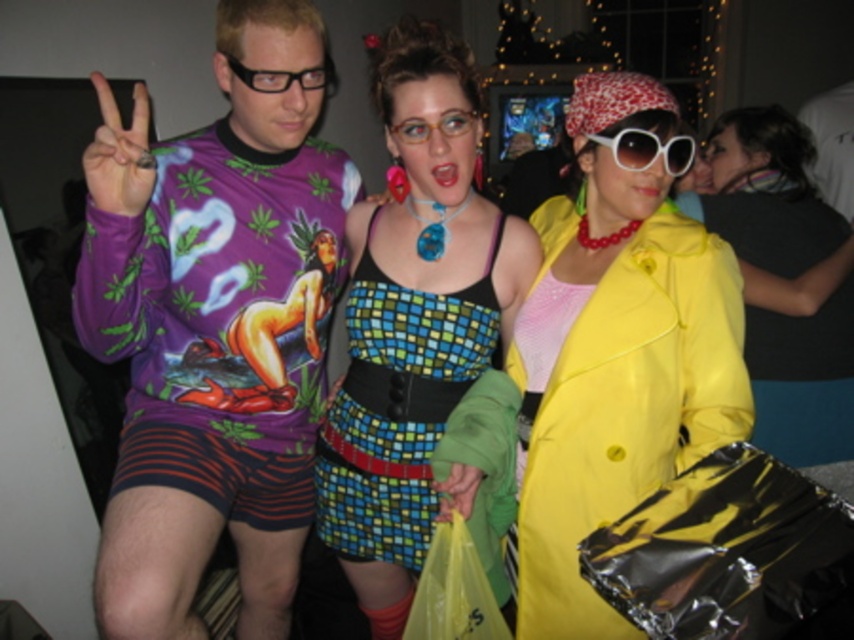
Question: Among these points, which one is farthest from the camera?

Choices:
 (A) (800, 244)
 (B) (630, 490)

Answer: (A)

Question: Observing the image, what is the correct spatial positioning of yellow satin coat at center in reference to white plastic sunglasses at center?

Choices:
 (A) right
 (B) left

Answer: (A)

Question: Does shiny yellow coat at center have a greater width compared to white plastic sunglasses at center?

Choices:
 (A) yes
 (B) no

Answer: (A)

Question: Which point is farther to the camera?

Choices:
 (A) purple printed shirt at center
 (B) multicolored mosaic dress at center
 (C) white plastic sunglasses at center

Answer: (B)

Question: Which point is closer to the camera?

Choices:
 (A) purple printed shirt at center
 (B) shiny yellow coat at center

Answer: (A)

Question: Where is yellow satin coat at center located in relation to white plastic sunglasses at center in the image?

Choices:
 (A) right
 (B) left

Answer: (A)